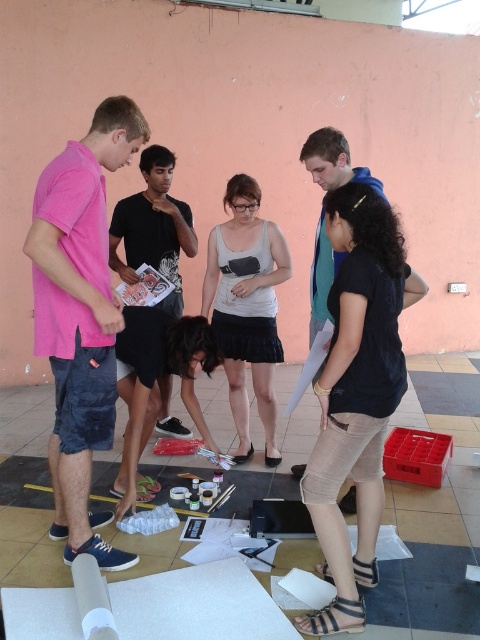
Can you confirm if matte gray tank top at center is shorter than black cotton shirt at center?

In fact, matte gray tank top at center may be taller than black cotton shirt at center.

Does matte gray tank top at center appear over black cotton shirt at center?

Actually, matte gray tank top at center is below black cotton shirt at center.

Describe the element at coordinates (247, 307) in the screenshot. I see `matte gray tank top at center` at that location.

Identify the location of matte gray tank top at center. (247, 307).

Is black linen skirt at lower center smaller than black matte shorts at center?

No.

Is point (334, 298) positioned behind point (143, 355)?

No, it is not.

Find the location of a particular element. black linen skirt at lower center is located at coordinates (357, 394).

Can you confirm if pink cotton shirt at left is positioned above blue cotton shirt at center?

No, pink cotton shirt at left is not above blue cotton shirt at center.

Does pink cotton shirt at left appear on the right side of blue cotton shirt at center?

Incorrect, pink cotton shirt at left is not on the right side of blue cotton shirt at center.

This screenshot has width=480, height=640. I want to click on pink cotton shirt at left, so click(81, 316).